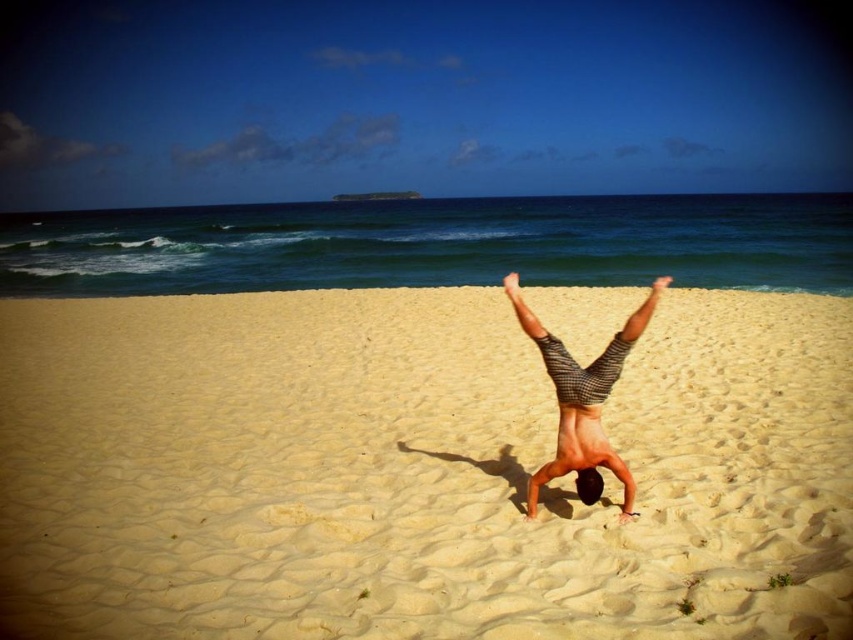
You are a photographer planning to capture the striped shorts at center and the smooth yellow sand at center in a single shot. Which object should you focus on first if you want both to be in sharp focus?

The smooth yellow sand at center is larger in size than striped shorts at center, so focusing on the smooth yellow sand at center first will ensure both are in sharp focus as it is the larger object.

You are standing at the point marked as point (x=415, y=470) on the beach. What is the texture of the ground beneath your feet?

The ground beneath your feet at point (x=415, y=470) is smooth yellow sand at center.